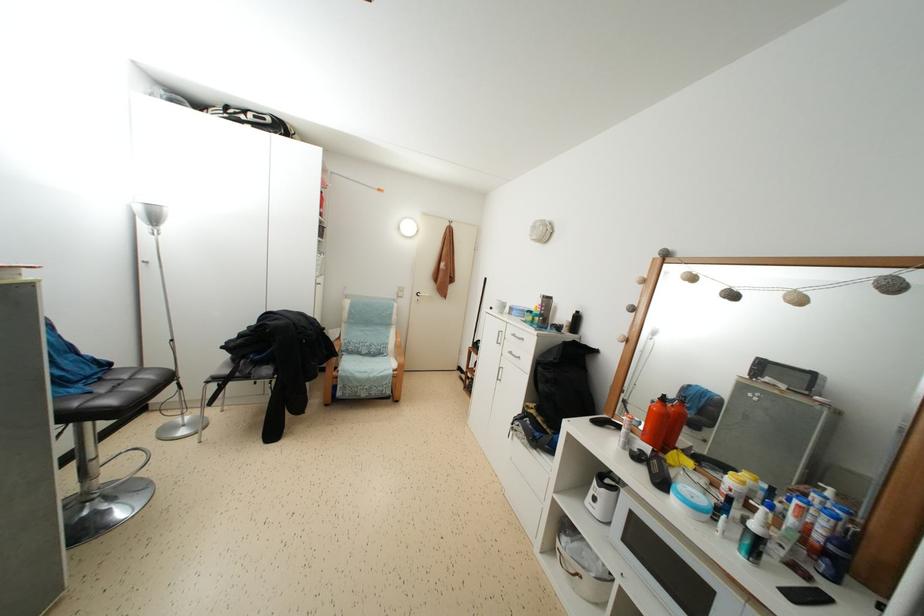
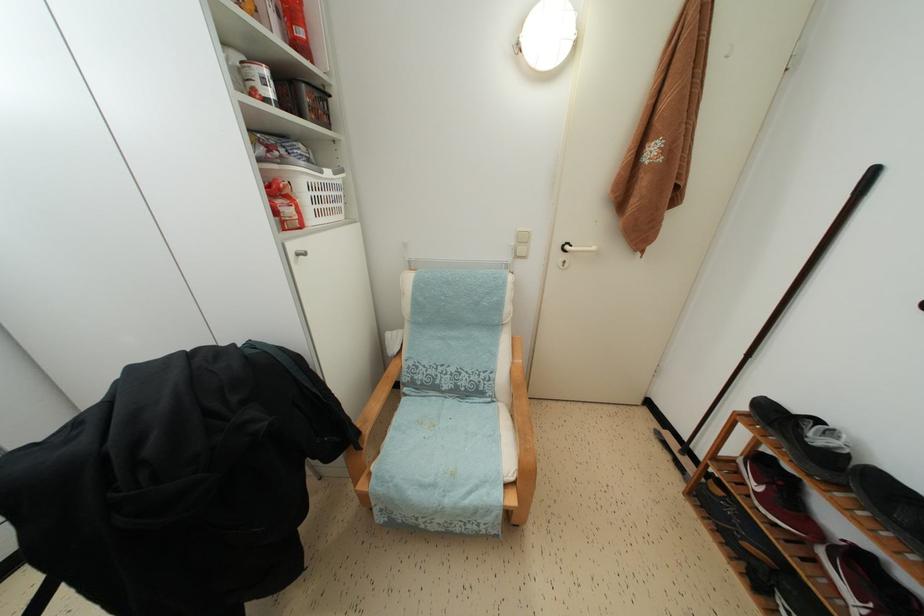
The point at (406, 294) is marked in the first image. Where is the corresponding point in the second image?

(527, 245)